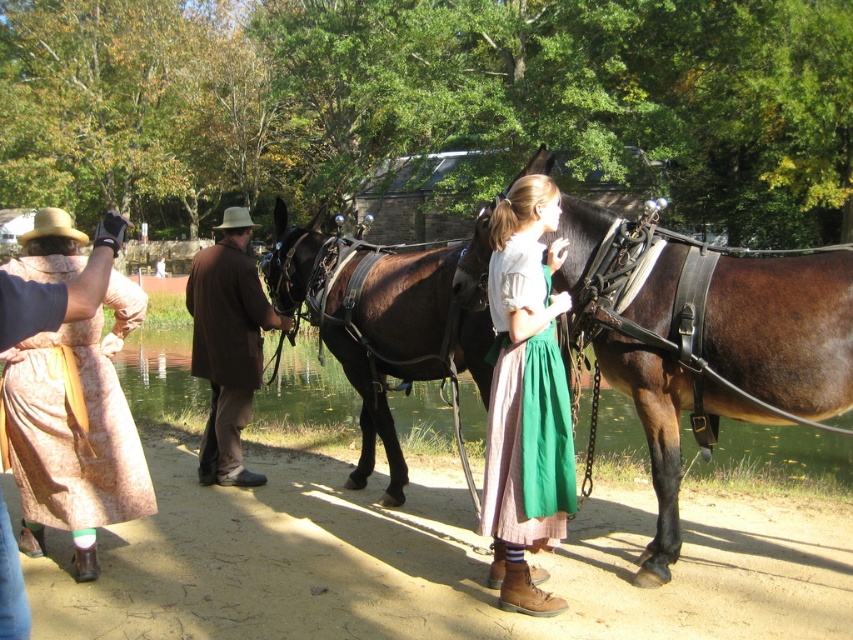
You are a rider observing two points marked in the scene. Which point is closer to you, point (97, 380) or point (192, 324)?

Point (97, 380) is in front of point (192, 324), so it is closer to you.

Based on the photo, you are a photographer trying to capture both the brown leather horse at center and the patterned fabric dress at left in a single frame. Given their sizes in the image, which object should you focus on to ensure both fit comfortably in the photo without cropping?

The brown leather horse at center occupies less space than the patterned fabric dress at left. To ensure both fit comfortably in the photo without cropping, focus on the patterned fabric dress at left since it requires more space.